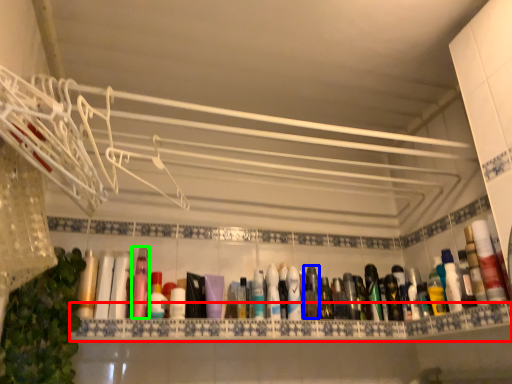
Question: Considering the real-world distances, which object is farthest from ledge (highlighted by a red box)? mouthwash (highlighted by a blue box) or mouthwash (highlighted by a green box)?

Choices:
 (A) mouthwash
 (B) mouthwash

Answer: (B)